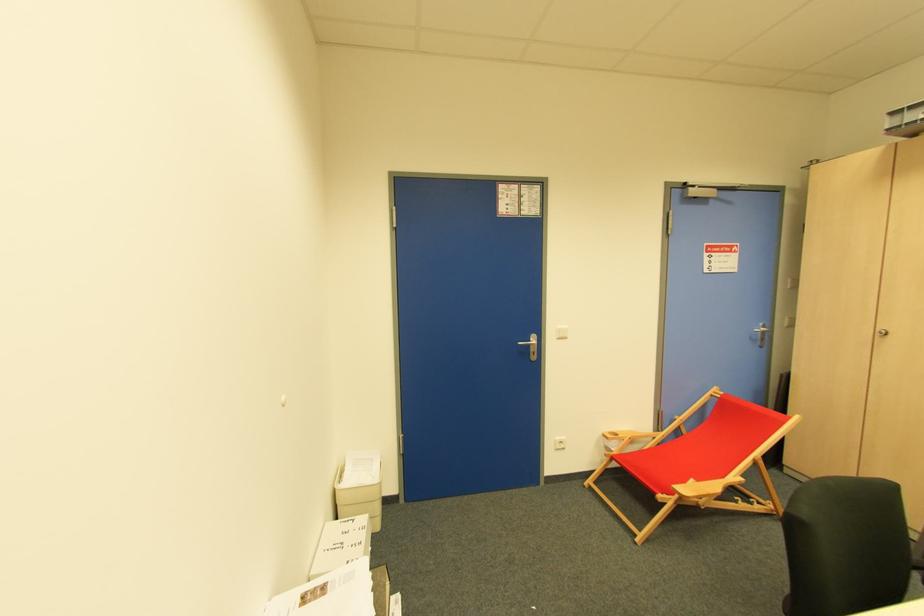
The image size is (924, 616). What do you see at coordinates (612, 435) in the screenshot? I see `the chair cup holder` at bounding box center [612, 435].